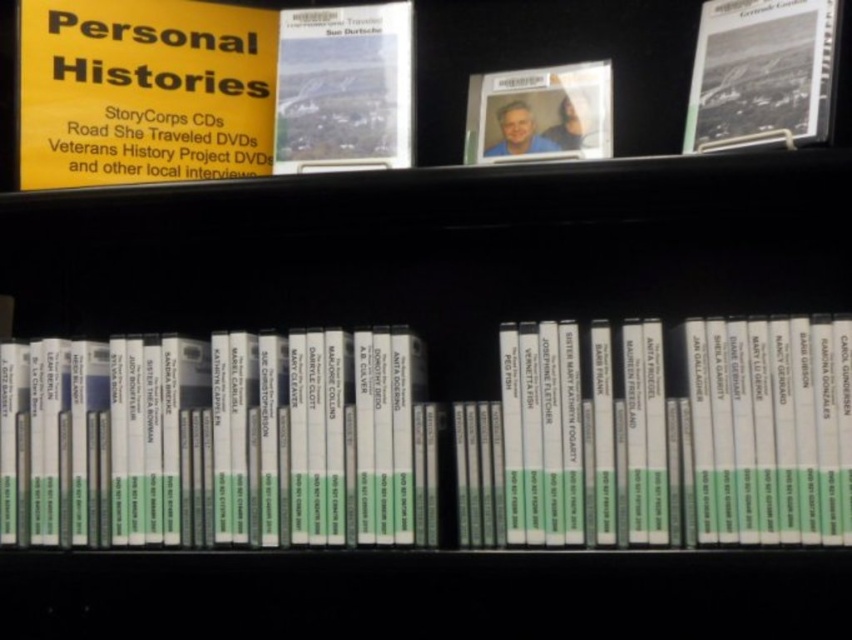
You are a librarian who needs to retrieve the black textured photo album at upper right from the shelf. If your arm can reach up to 80 centimeters, will you be able to reach it?

The black textured photo album at upper right is 90.79 centimeters away from the viewer. Since your arm can only reach up to 80 centimeters, you will not be able to reach it.

You are a delivery person who needs to place a new box on the shelf. The box requires a spot that is at least 30 inches away from the camera to ensure it doesn not fall off the shelf. Can you place the box at point (485, 422)?

The distance of point (485, 422) from camera is 35.28 inches, which is more than the required 30 inches. Therefore, you can safely place the box at point (485, 422).